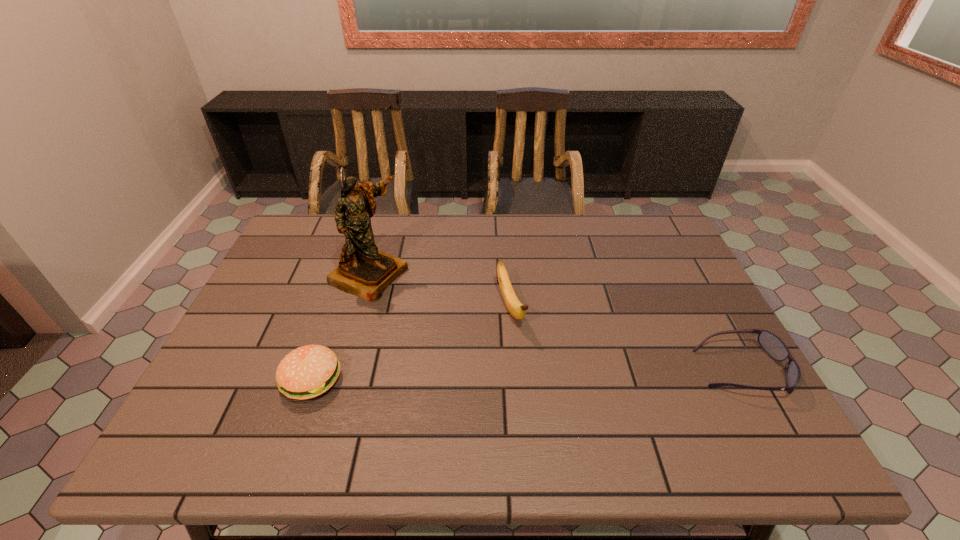
Find the location of a particular element. vacant area in the image that satisfies the following two spatial constraints: 1. on the front side of the second object from right to left; 2. on the lenses of the sunglasses is located at coordinates (515, 370).

Locate an element on the screen. Image resolution: width=960 pixels, height=540 pixels. vacant space that satisfies the following two spatial constraints: 1. on the back side of the figurine; 2. on the left side of the patty is located at coordinates (348, 274).